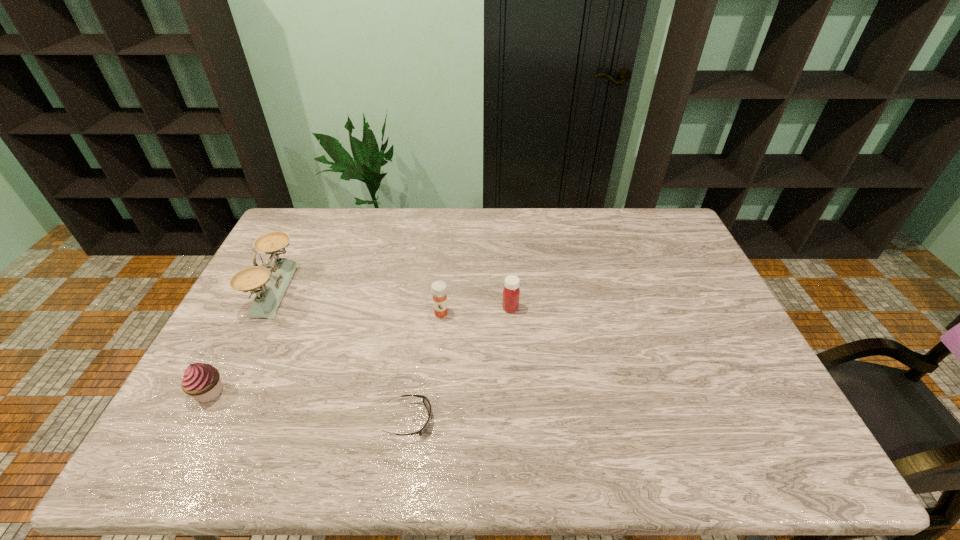
This screenshot has width=960, height=540. Find the location of `the tallest object`. the tallest object is located at coordinates (272, 284).

Find the location of a particular element. The height and width of the screenshot is (540, 960). the right medicine is located at coordinates (511, 293).

I want to click on cupcake, so click(x=202, y=381).

What are the coordinates of `the left medicine` in the screenshot? It's located at (438, 288).

Find the location of a particular element. goggles is located at coordinates (426, 402).

Where is `vacant region located 0.220m on the front-facing side of the scale`? The height and width of the screenshot is (540, 960). vacant region located 0.220m on the front-facing side of the scale is located at coordinates (362, 290).

The height and width of the screenshot is (540, 960). Identify the location of free space located on the back of the right medicine. (505, 231).

Locate an element on the screen. vacant area located on the front of the cupcake is located at coordinates (183, 441).

This screenshot has height=540, width=960. I want to click on free space located on the label side of the left medicine, so coord(432,417).

Find the location of a particular element. This screenshot has height=540, width=960. blank space located on the lenses of the goggles is located at coordinates (458, 420).